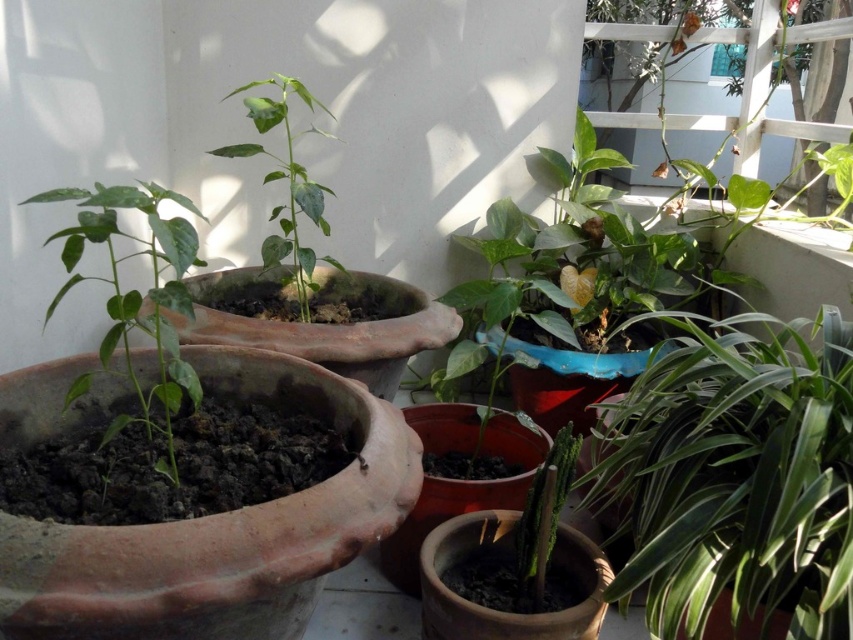
Can you confirm if green glossy leafy plant at center-right is positioned above green matte plant at center?

No.

Is green glossy leafy plant at center-right taller than green matte plant at center?

No, green glossy leafy plant at center-right is not taller than green matte plant at center.

Image resolution: width=853 pixels, height=640 pixels. Describe the element at coordinates (735, 477) in the screenshot. I see `green glossy leafy plant at center-right` at that location.

This screenshot has height=640, width=853. What are the coordinates of `green glossy leafy plant at center-right` in the screenshot? It's located at (735, 477).

Is the position of green glossy leafy plant at center-right less distant than that of green matte plant at left?

No, it is not.

Does green glossy leafy plant at center-right have a smaller size compared to green matte plant at left?

No.

Who is more forward, (781,596) or (136,392)?

Point (781,596) is in front.

Locate an element on the screen. green glossy leafy plant at center-right is located at coordinates (735, 477).

Does green matte plant at left appear under green matte plant at center?

Yes.

Can you confirm if green matte plant at left is positioned to the left of green matte plant at center?

Indeed, green matte plant at left is positioned on the left side of green matte plant at center.

What do you see at coordinates (136, 291) in the screenshot? I see `green matte plant at left` at bounding box center [136, 291].

Where is `green matte plant at left`? green matte plant at left is located at coordinates (136, 291).